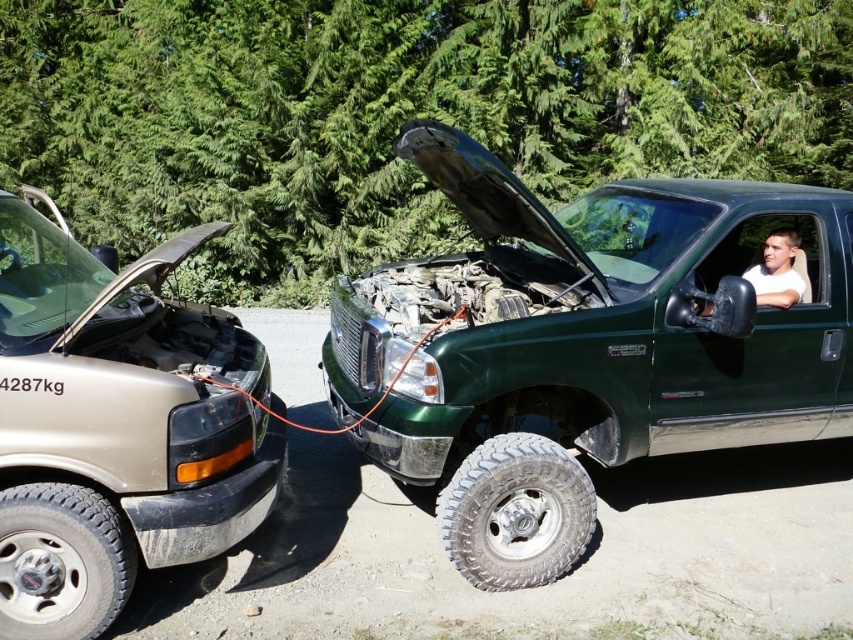
Does green matte truck at center appear on the left side of silver metallic tire at lower center?

No, green matte truck at center is not to the left of silver metallic tire at lower center.

Is green matte truck at center closer to camera compared to silver metallic tire at lower center?

No, it is behind silver metallic tire at lower center.

Between point (718, 385) and point (561, 460), which one is positioned in front?

Positioned in front is point (561, 460).

Identify the location of green matte truck at center. (585, 346).

In the scene shown: Who is taller, silver metallic tire at lower center or black rubber tire at lower left?

silver metallic tire at lower center is taller.

What are the coordinates of `silver metallic tire at lower center` in the screenshot? It's located at (515, 513).

Can you confirm if green matte truck at center is positioned above matte black truck at left?

Indeed, green matte truck at center is positioned over matte black truck at left.

Is point (498, 164) in front of point (96, 554)?

That is False.

You are a GUI agent. You are given a task and a screenshot of the screen. Output one action in this format:
    pyautogui.click(x=<x>, y=<y>)
    Task: Click on the green matte truck at center
    The width and height of the screenshot is (853, 640).
    Given the screenshot: What is the action you would take?
    [585, 346]